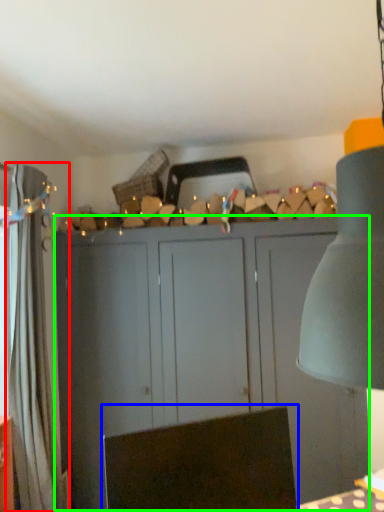
Question: Which object is positioned farthest from curtain (highlighted by a red box)? Select from swivel chair (highlighted by a blue box) and cupboard (highlighted by a green box).

Choices:
 (A) swivel chair
 (B) cupboard

Answer: (A)